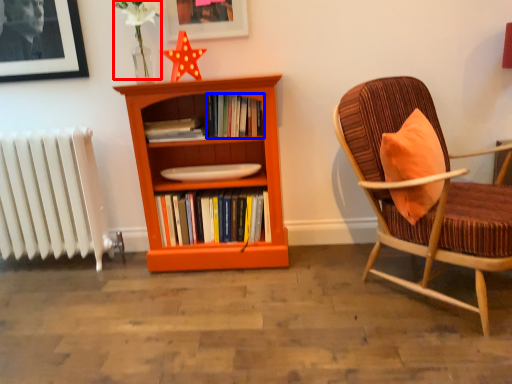
Question: Which object is further to the camera taking this photo, flower (highlighted by a red box) or book (highlighted by a blue box)?

Choices:
 (A) flower
 (B) book

Answer: (B)